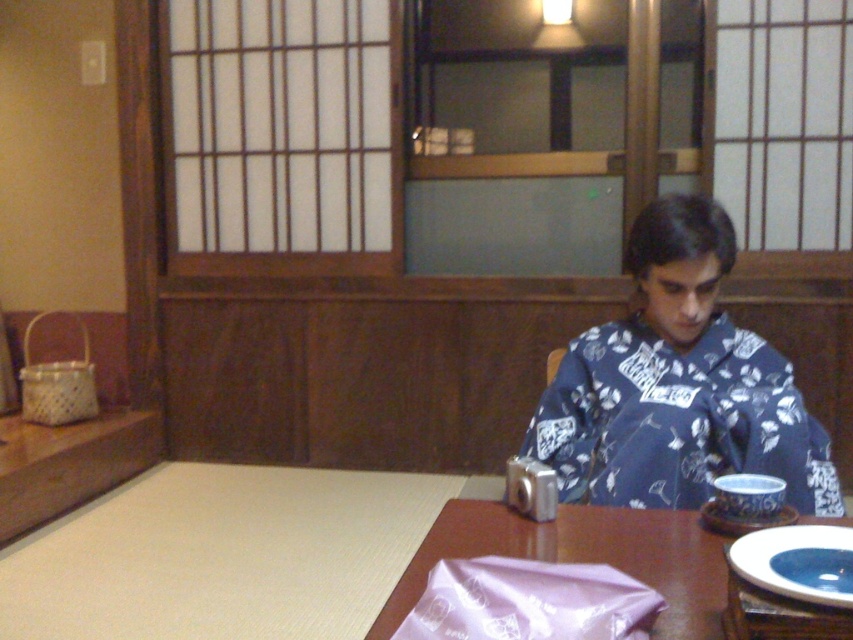
Question: Which of the following is the farthest from the observer?

Choices:
 (A) blue glossy plate at lower right
 (B) blue floral kimono at center
 (C) brown wooden table at center

Answer: (C)

Question: Which point is closer to the camera?

Choices:
 (A) blue glossy plate at lower right
 (B) blue floral kimono at center
 (C) brown wooden table at center

Answer: (A)

Question: Is brown wooden table at center bigger than blue floral kimono at center?

Choices:
 (A) yes
 (B) no

Answer: (A)

Question: Which point is farther to the camera?

Choices:
 (A) brown wooden table at center
 (B) blue glossy plate at lower right

Answer: (A)

Question: Is brown wooden table at center thinner than blue glossy plate at lower right?

Choices:
 (A) no
 (B) yes

Answer: (A)

Question: Can you confirm if brown wooden table at center is positioned to the left of blue glossy plate at lower right?

Choices:
 (A) no
 (B) yes

Answer: (B)